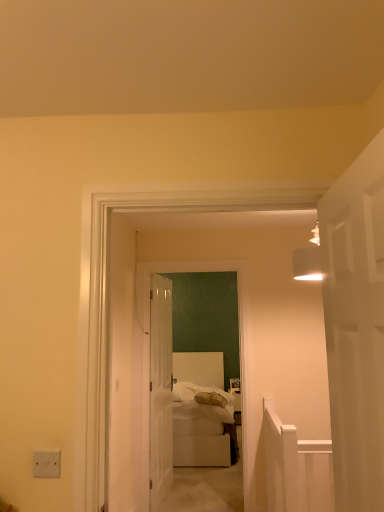
You are a GUI agent. You are given a task and a screenshot of the screen. Output one action in this format:
    pyautogui.click(x=<x>, y=<y>)
    Task: Click on the vacant space underneath clear glass door at center, marked as the 2th door in a right-to-left arrangement (from a real-world perspective)
    
    Given the screenshot: What is the action you would take?
    pyautogui.click(x=162, y=496)